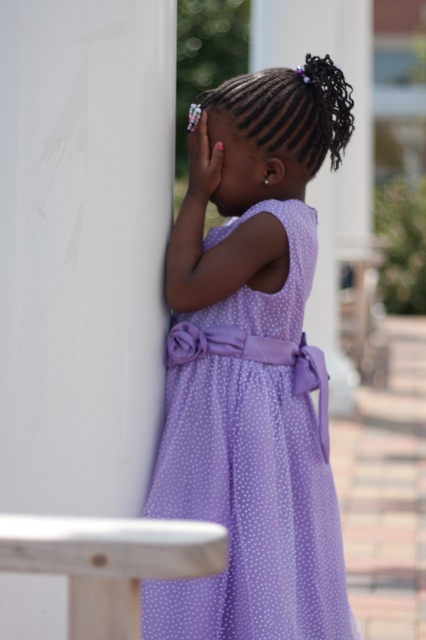
Question: Can you confirm if white smooth pillar at left is smaller than lavender polka dot dress at center?

Choices:
 (A) no
 (B) yes

Answer: (B)

Question: Which point is farther to the camera?

Choices:
 (A) (69, 214)
 (B) (270, 410)

Answer: (B)

Question: Among these points, which one is nearest to the camera?

Choices:
 (A) (158, 22)
 (B) (164, 628)

Answer: (B)

Question: Is white smooth pillar at left wider than lavender polka dot dress at center?

Choices:
 (A) yes
 (B) no

Answer: (B)

Question: Which object appears farthest from the camera in this image?

Choices:
 (A) white smooth pillar at left
 (B) lavender polka dot dress at center

Answer: (B)

Question: Considering the relative positions of white smooth pillar at left and lavender polka dot dress at center in the image provided, where is white smooth pillar at left located with respect to lavender polka dot dress at center?

Choices:
 (A) above
 (B) below

Answer: (A)